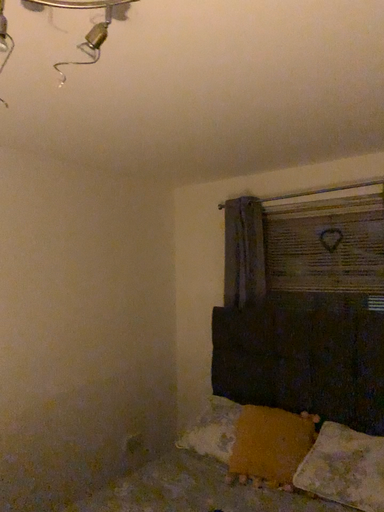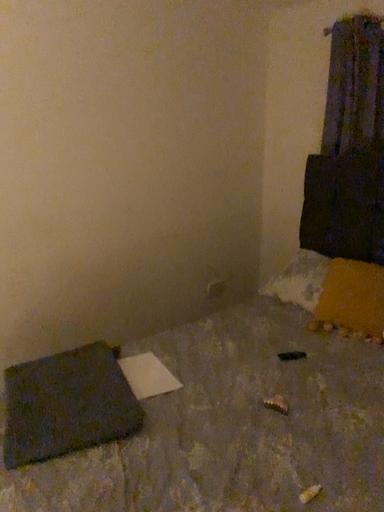
Question: How did the camera likely rotate when shooting the video?

Choices:
 (A) rotated upward
 (B) rotated downward

Answer: (B)